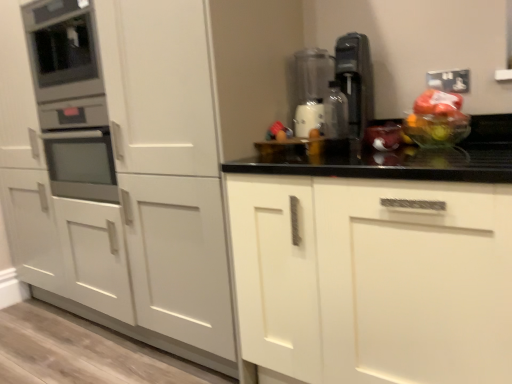
Question: Considering the positions of transparent plastic blender at center, the 1th appliance positioned from the right, and translucent plastic bag of fruit at right in the image, is transparent plastic blender at center, the 1th appliance positioned from the right, bigger or smaller than translucent plastic bag of fruit at right?

Choices:
 (A) big
 (B) small

Answer: (A)

Question: From the image's perspective, is transparent plastic blender at center, which is the 2th appliance from left to right, positioned above or below translucent plastic bag of fruit at right?

Choices:
 (A) below
 (B) above

Answer: (B)

Question: Based on their relative distances, which object is farther from the translucent plastic bag at center?

Choices:
 (A) metallic oven at left, placed as the second appliance when sorted from right to left
 (B) white matte cabinet at center, arranged as the 1th cabinetry when viewed from the left
 (C) white matte cabinet at center, the first cabinetry viewed from the right
 (D) transparent plastic blender at center, which is the 2th appliance from left to right
 (E) translucent plastic bag of fruit at right

Answer: (A)

Question: Estimate the real-world distances between objects in this image. Which object is closer to the metallic silver bottle at center?

Choices:
 (A) translucent plastic bag of fruit at right
 (B) white matte cabinet at center, the first cabinetry viewed from the right
 (C) transparent plastic blender at center, the 1th appliance positioned from the right
 (D) translucent plastic bag at center
 (E) satin silver coffee machine at upper right

Answer: (E)